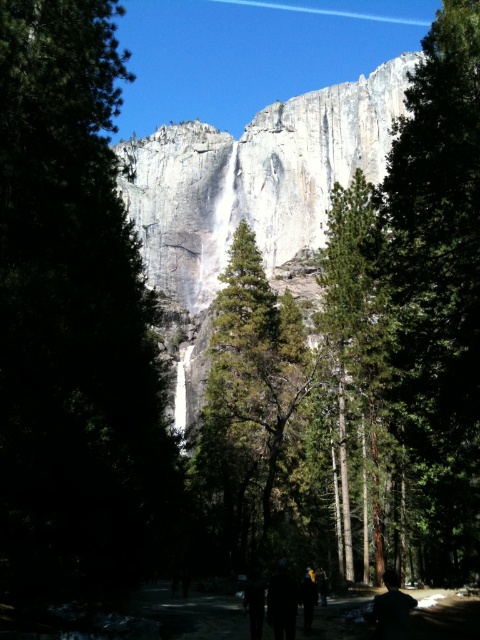
Is green matte tree at center smaller than black matte person at lower right?

Actually, green matte tree at center might be larger than black matte person at lower right.

How much distance is there between green matte tree at center and black matte person at lower right?

green matte tree at center is 23.01 meters from black matte person at lower right.

Does point (444, 237) come farther from viewer compared to point (374, 602)?

Yes, point (444, 237) is farther from viewer.

Find the location of `green matte tree at center`. green matte tree at center is located at coordinates (439, 282).

Which of these two, green textured tree at left or black matte person at lower right, stands taller?

green textured tree at left

From the picture: Who is more distant from viewer, (14, 406) or (384, 628)?

The point (14, 406) is behind.

This screenshot has width=480, height=640. In order to click on green textured tree at left in this screenshot , I will do coord(72,323).

Between point (25, 131) and point (357, 161), which one is positioned behind?

The point (357, 161) is behind.

How distant is green textured tree at left from white rock face at center?

green textured tree at left is 38.91 meters away from white rock face at center.

What are the coordinates of `green textured tree at left` in the screenshot? It's located at 72,323.